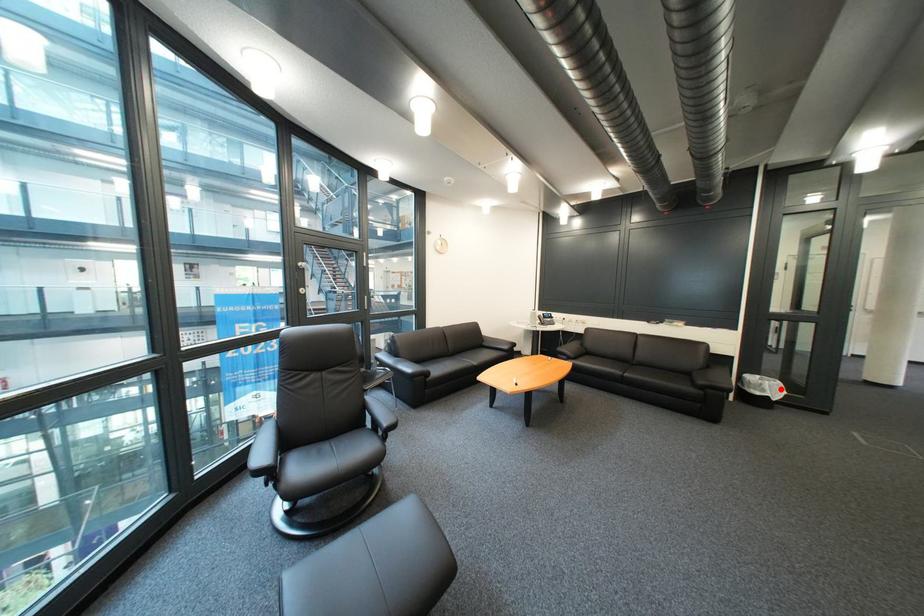
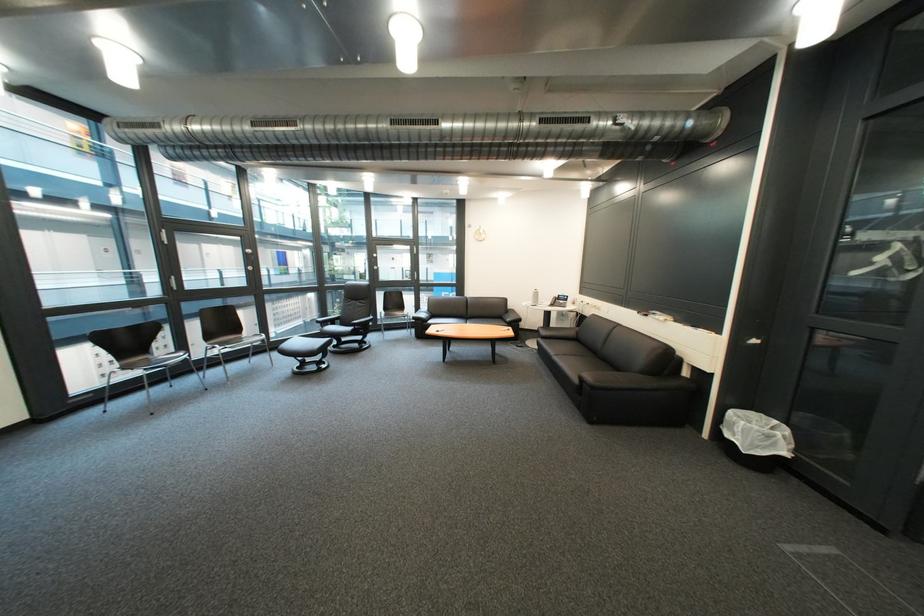
Question: I am providing you with two images of the same scene from different viewpoints. Given a red point in image1, look at the same physical point in image2. Is it:

Choices:
 (A) Closer to the viewpoint
 (B) Farther from the viewpoint

Answer: (B)